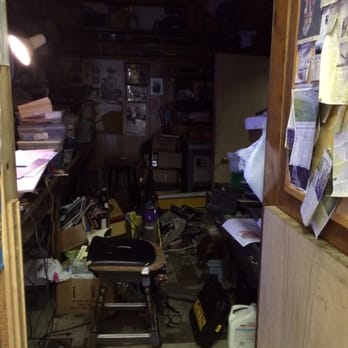
Locate an element on the screen. This screenshot has width=348, height=348. jug is located at coordinates (241, 323).